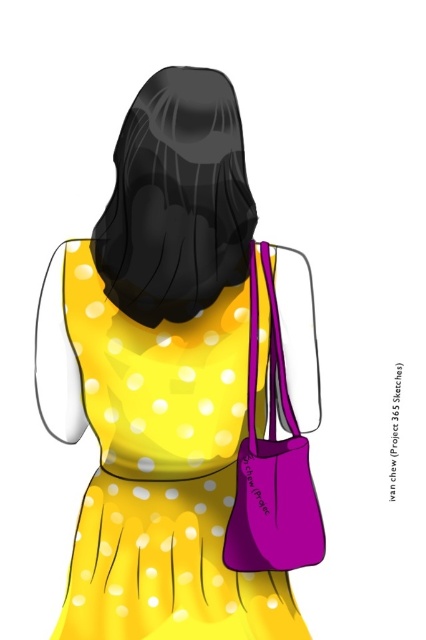
Which is behind, point (184, 621) or point (287, 524)?

Point (184, 621)

Can you confirm if matte purple bag at lower right is thinner than purple matte bag at right?

No.

Which is in front, point (299, 557) or point (298, 490)?

Point (298, 490)

Locate an element on the screen. The height and width of the screenshot is (640, 426). matte purple bag at lower right is located at coordinates (183, 387).